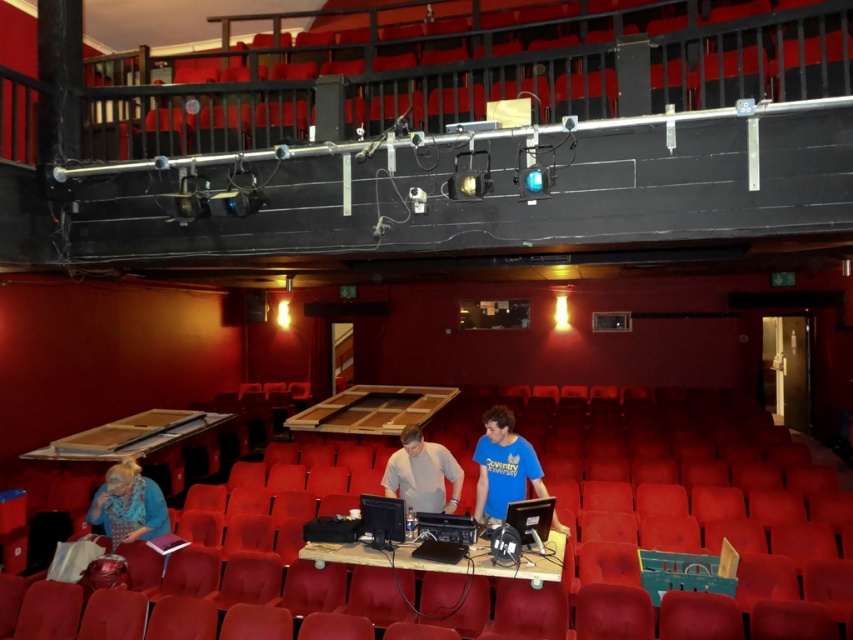
Between point (512, 460) and point (450, 472), which one is positioned behind?

Point (450, 472)

Does blue t-shirt at center appear under light gray shirt at center?

Correct, blue t-shirt at center is located below light gray shirt at center.

Who is more distant from viewer, (x=477, y=486) or (x=416, y=449)?

Point (x=477, y=486)

Locate an element on the screen. blue t-shirt at center is located at coordinates (503, 467).

Can you confirm if blue t-shirt at center is positioned to the right of blue fabric at lower left?

Correct, you'll find blue t-shirt at center to the right of blue fabric at lower left.

Is point (534, 456) positioned after point (125, 497)?

No.

Identify the location of blue t-shirt at center. (503, 467).

Is light gray shirt at center positioned before blue fabric at lower left?

Yes, it is in front of blue fabric at lower left.

Measure the distance from light gray shirt at center to blue fabric at lower left.

A distance of 6.83 feet exists between light gray shirt at center and blue fabric at lower left.

I want to click on light gray shirt at center, so click(x=422, y=474).

This screenshot has width=853, height=640. What are the coordinates of `light gray shirt at center` in the screenshot? It's located at (422, 474).